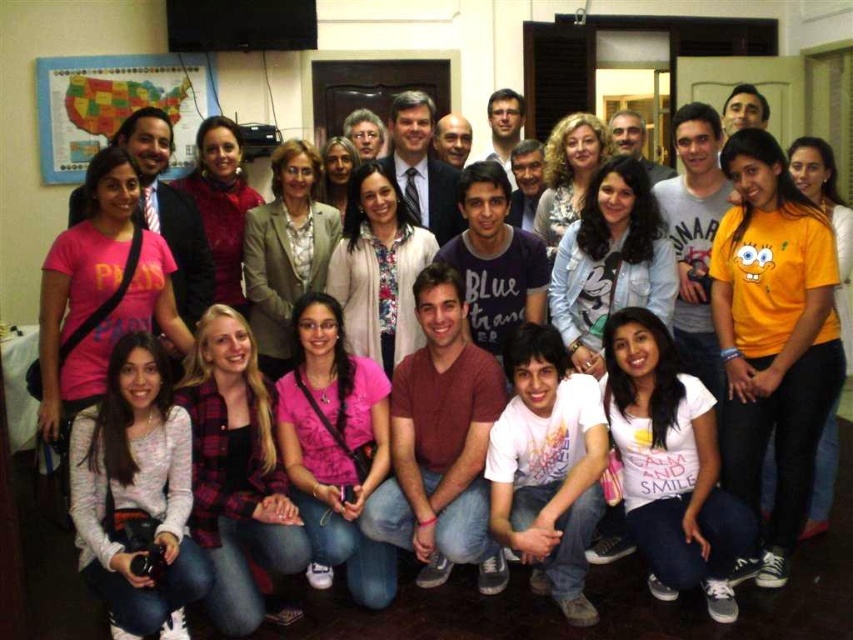
Question: Which point appears closest to the camera in this image?

Choices:
 (A) [328, 465]
 (B) [608, 396]
 (C) [100, 477]

Answer: (C)

Question: Which of the following is the closest to the observer?

Choices:
 (A) (341, 545)
 (B) (165, 400)
 (C) (709, 604)

Answer: (A)

Question: Is white cotton t-shirt at lower center wider than pink fabric shirt at center?

Choices:
 (A) yes
 (B) no

Answer: (B)

Question: Which point is closer to the camera?

Choices:
 (A) (112, 516)
 (B) (354, 593)
 (C) (648, 388)

Answer: (A)

Question: In this image, where is white knit sweater at lower left located relative to white cotton t-shirt at lower center?

Choices:
 (A) left
 (B) right

Answer: (A)

Question: In this image, where is white knit sweater at lower left located relative to white cotton t-shirt at lower center?

Choices:
 (A) above
 (B) below

Answer: (B)